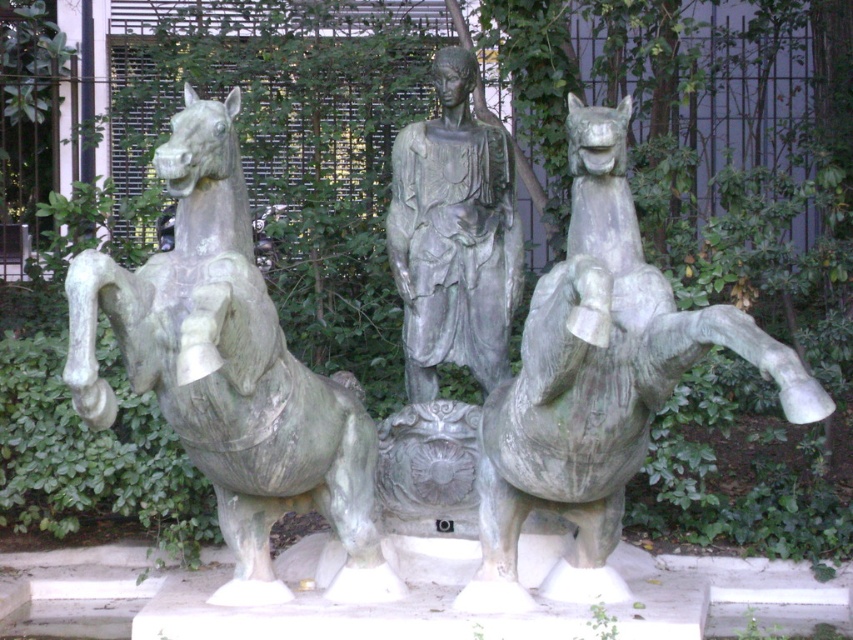
Question: Does green patina horse at left appear on the right side of green patina horse at center?

Choices:
 (A) yes
 (B) no

Answer: (B)

Question: Which of these objects is positioned closest to the gray stone statue at center?

Choices:
 (A) green patina horse at left
 (B) green patina horse at center

Answer: (A)

Question: Is green patina horse at left positioned at the back of gray stone statue at center?

Choices:
 (A) yes
 (B) no

Answer: (B)

Question: Among these points, which one is farthest from the camera?

Choices:
 (A) (219, 253)
 (B) (476, 248)
 (C) (751, 348)

Answer: (B)

Question: Is green patina horse at left smaller than green patina horse at center?

Choices:
 (A) yes
 (B) no

Answer: (B)

Question: Which point is farther from the camera taking this photo?

Choices:
 (A) (605, 529)
 (B) (241, 340)
 (C) (444, 262)

Answer: (C)